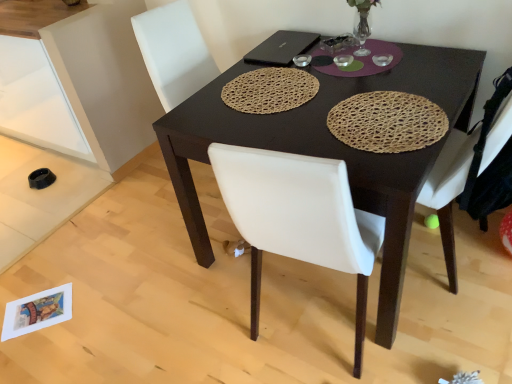
Where is `free location in front of black matte laptop at upper center`? The width and height of the screenshot is (512, 384). free location in front of black matte laptop at upper center is located at coordinates (287, 73).